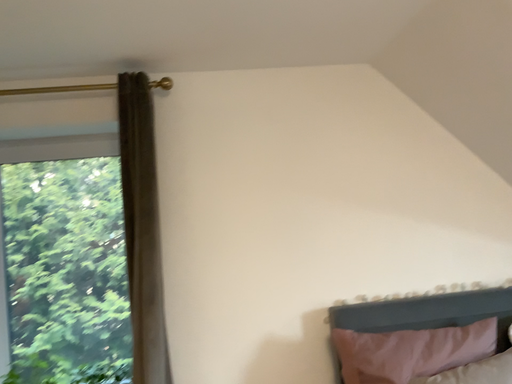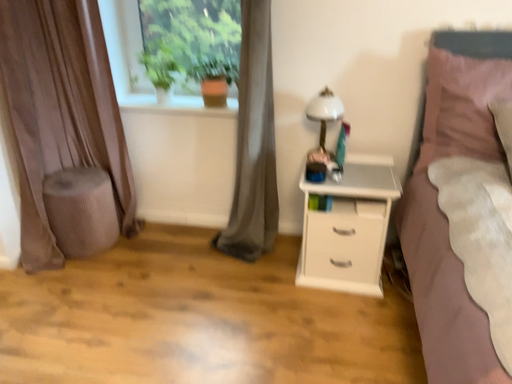
Question: Which way did the camera rotate in the video?

Choices:
 (A) rotated right
 (B) rotated left

Answer: (B)